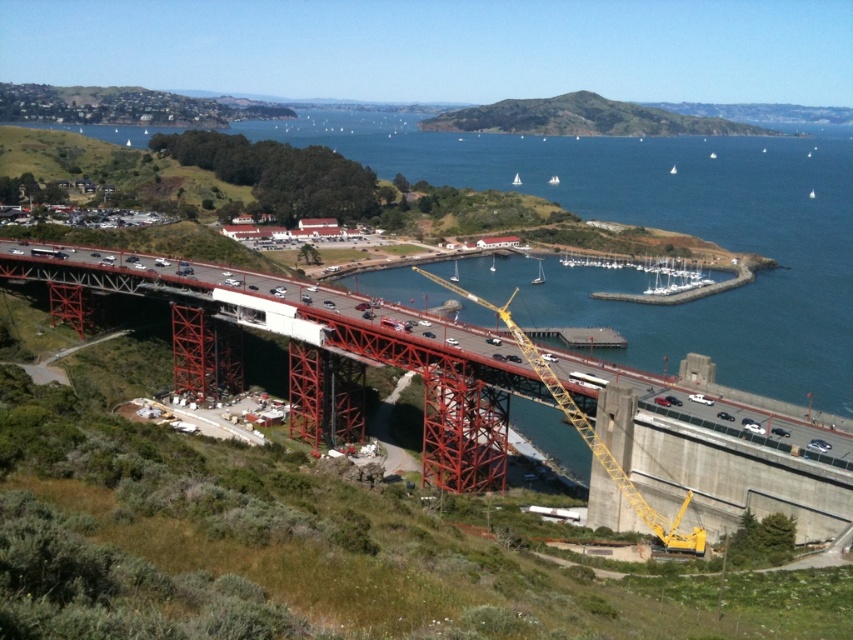
You are a photographer planning to capture a landscape shot of the coastal area. You want to ensure that both the green grassy hillside at upper center and the white plastic sailboat at center are clearly visible in the frame. Based on their sizes, which object might require you to adjust your camera angle to include more of it in the photo?

The green grassy hillside at upper center might be wider than the white plastic sailboat at center, so you may need to adjust your camera angle to include more of the green grassy hillside at upper center in the photo.

You are a photographer trying to capture the entire scene of the blue water at center and the yellow metallic crane at center in one shot. Based on their heights, which object will appear taller in your photo?

The blue water at center appears taller in the photo because it has a greater height compared to the yellow metallic crane at center.